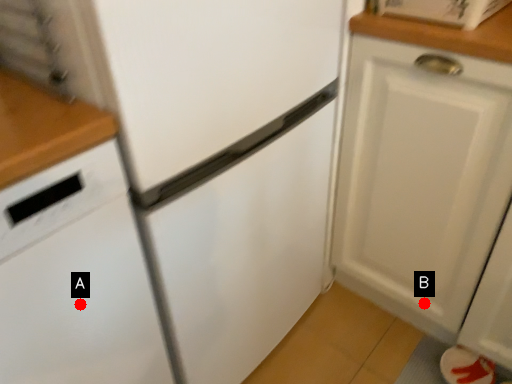
Question: Two points are circled on the image, labeled by A and B beside each circle. Among these points, which one is farthest from the camera?

Choices:
 (A) A is further
 (B) B is further

Answer: (B)